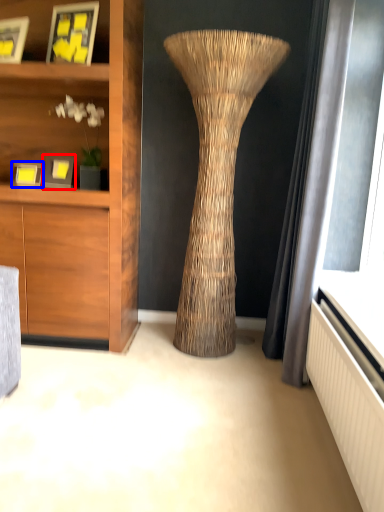
Question: Which object appears closest to the camera in this image, picture frame (highlighted by a red box) or picture frame (highlighted by a blue box)?

Choices:
 (A) picture frame
 (B) picture frame

Answer: (A)